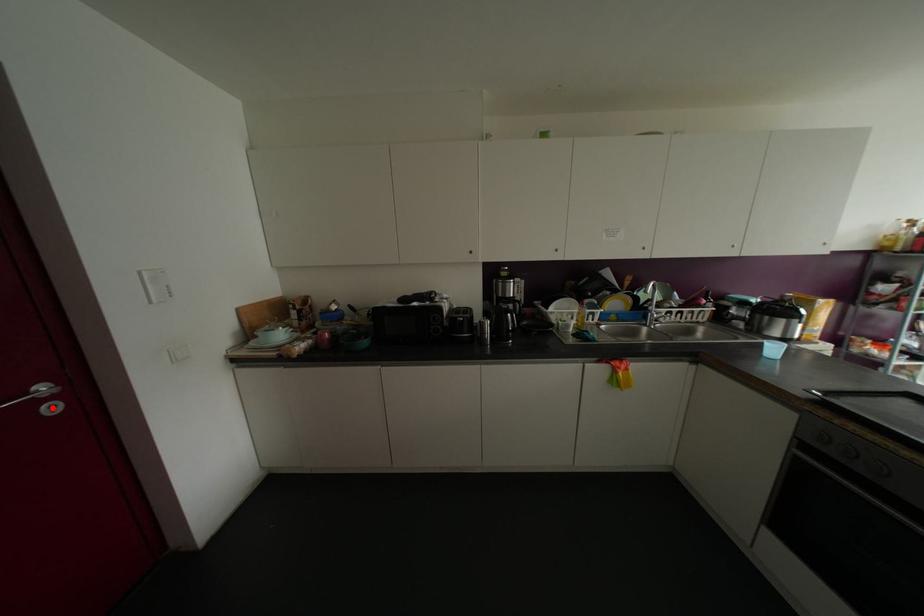
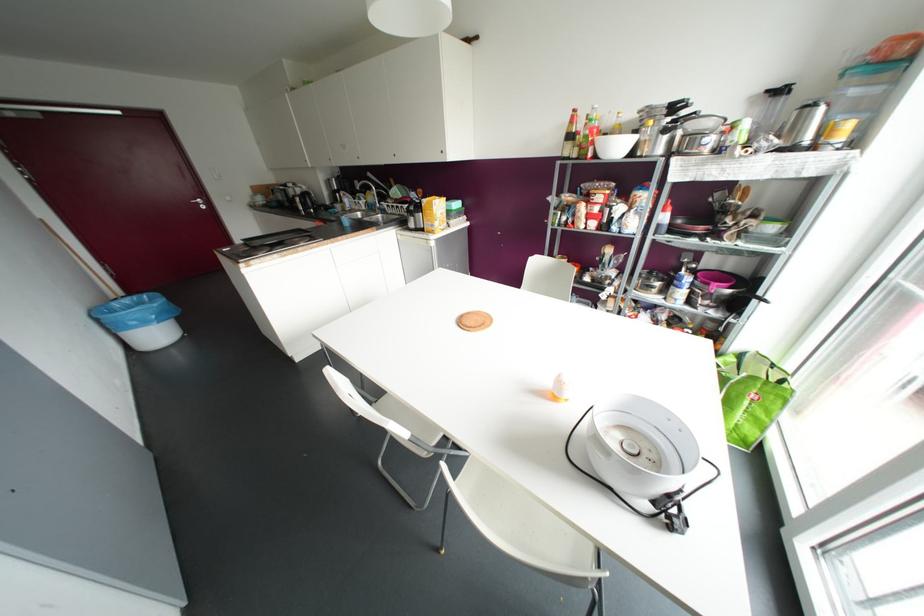
Question: I am providing you with two images of the same scene from different viewpoints. In image1, a red point is highlighted. Considering the same 3D point in image2, which of the following is correct?

Choices:
 (A) It is closer
 (B) It is farther

Answer: (A)